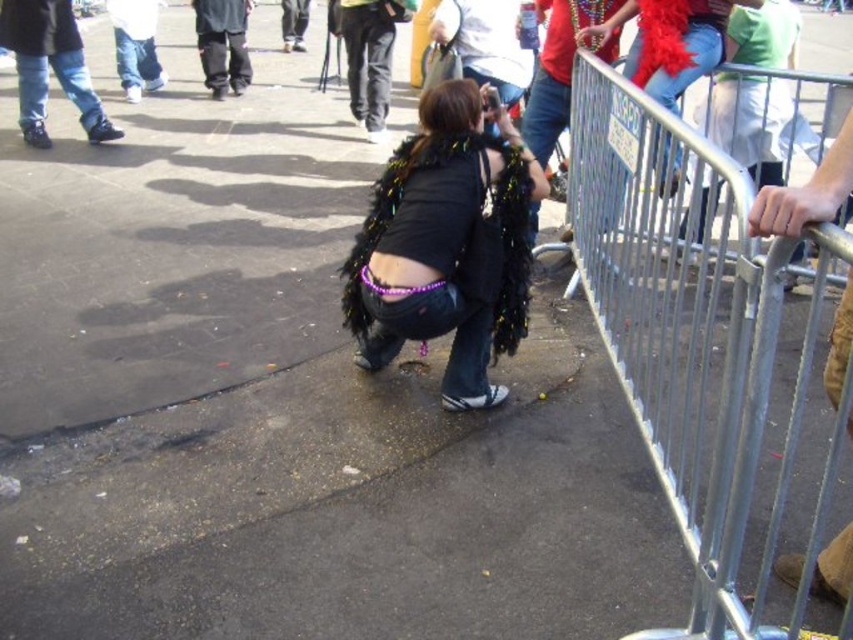
Question: Which of the following is the closest to the observer?

Choices:
 (A) (498, 275)
 (B) (666, 426)

Answer: (B)

Question: Which object appears farthest from the camera in this image?

Choices:
 (A) black sequined feather boa at center
 (B) silver metallic rail at right

Answer: (A)

Question: Is silver metallic rail at right bigger than black sequined feather boa at center?

Choices:
 (A) yes
 (B) no

Answer: (A)

Question: Can you confirm if silver metallic rail at right is bigger than black sequined feather boa at center?

Choices:
 (A) no
 (B) yes

Answer: (B)

Question: Does silver metallic rail at right have a smaller size compared to black sequined feather boa at center?

Choices:
 (A) yes
 (B) no

Answer: (B)